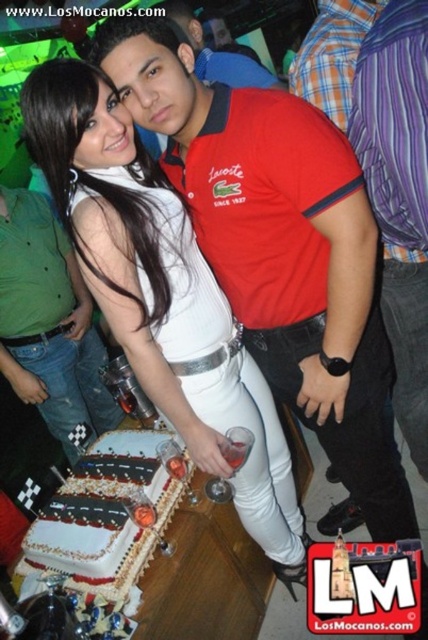
Can you confirm if white satin dress at center is positioned to the right of matte red polo shirt at center?

Indeed, white satin dress at center is positioned on the right side of matte red polo shirt at center.

Is white satin dress at center bigger than matte red polo shirt at center?

Yes.

Is point (116, 195) positioned behind point (244, 74)?

That is False.

Find the location of a particular element. This screenshot has width=428, height=640. white satin dress at center is located at coordinates (162, 296).

Can you confirm if red cotton polo shirt at center is positioned above purple striped shirt at right?

No, red cotton polo shirt at center is not above purple striped shirt at right.

Between red cotton polo shirt at center and purple striped shirt at right, which one appears on the left side from the viewer's perspective?

red cotton polo shirt at center

Is point (318, 236) farther from viewer compared to point (341, 108)?

No.

Where is `red cotton polo shirt at center`? This screenshot has width=428, height=640. red cotton polo shirt at center is located at coordinates (279, 248).

Who is positioned more to the left, white fondant cake at center or matte red polo shirt at center?

From the viewer's perspective, white fondant cake at center appears more on the left side.

Which is more to the right, white fondant cake at center or matte red polo shirt at center?

matte red polo shirt at center

Identify the location of white fondant cake at center. The width and height of the screenshot is (428, 640). (104, 515).

This screenshot has height=640, width=428. I want to click on white fondant cake at center, so click(x=104, y=515).